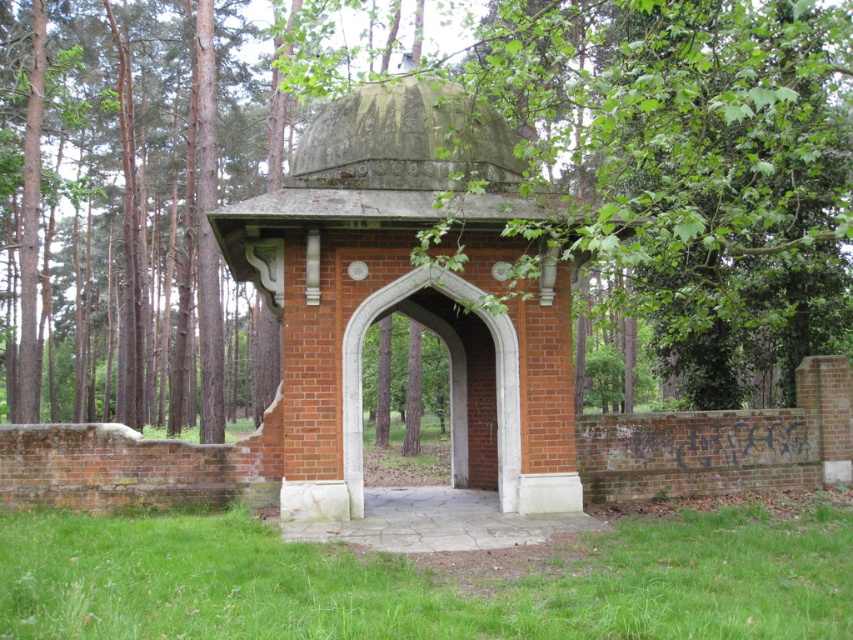
Question: Which object is the farthest from the green leafy tree at center?

Choices:
 (A) green grass at lower center
 (B) red brick gazebo at center

Answer: (A)

Question: Which object appears farthest from the camera in this image?

Choices:
 (A) red brick gazebo at center
 (B) green leafy tree at center
 (C) green grass at lower center

Answer: (A)

Question: Which point is farther to the camera?

Choices:
 (A) (524, 365)
 (B) (148, 524)
 (C) (672, 67)

Answer: (A)

Question: Does green leafy tree at center have a smaller size compared to green grass at lower center?

Choices:
 (A) yes
 (B) no

Answer: (B)

Question: Is green leafy tree at center smaller than red brick gazebo at center?

Choices:
 (A) no
 (B) yes

Answer: (A)

Question: Is the position of red brick gazebo at center more distant than that of green grass at lower center?

Choices:
 (A) no
 (B) yes

Answer: (B)